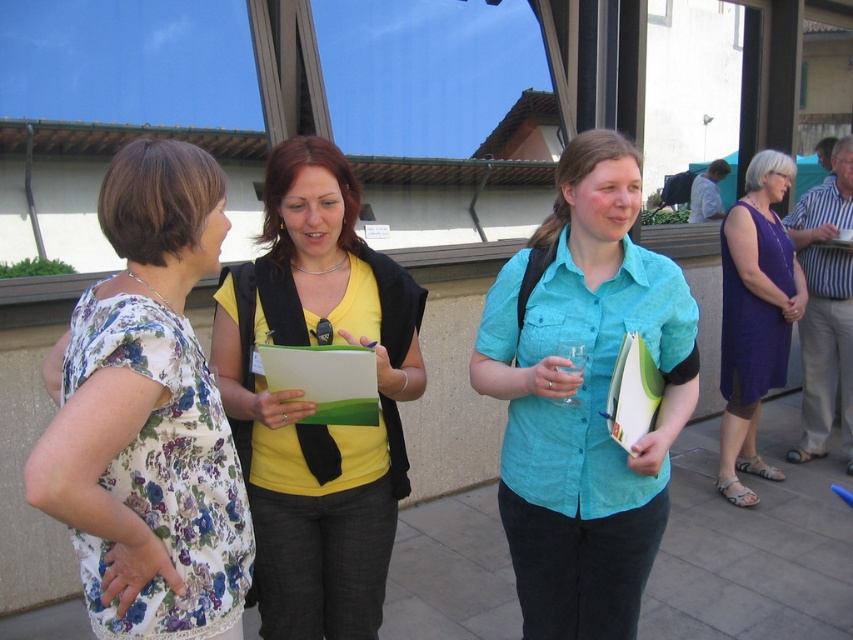
Is teal cotton shirt at center smaller than yellow matte shirt at center?

No.

Who is taller, teal cotton shirt at center or yellow matte shirt at center?

With more height is teal cotton shirt at center.

Which is behind, point (625, 307) or point (349, 184)?

The point (349, 184) is more distant.

The height and width of the screenshot is (640, 853). I want to click on teal cotton shirt at center, so click(x=583, y=397).

Can you confirm if yellow matte shirt at center is positioned to the left of green matte clipboard at center?

No, yellow matte shirt at center is not to the left of green matte clipboard at center.

Is yellow matte shirt at center shorter than green matte clipboard at center?

No.

Which is behind, point (386, 358) or point (328, 348)?

The point (386, 358) is behind.

Find the location of a particular element. The height and width of the screenshot is (640, 853). yellow matte shirt at center is located at coordinates (312, 404).

Does floral fabric dress at left appear over teal cotton shirt at center?

Yes.

Between floral fabric dress at left and teal cotton shirt at center, which one has more height?

Standing taller between the two is teal cotton shirt at center.

Find the location of a particular element. floral fabric dress at left is located at coordinates (148, 416).